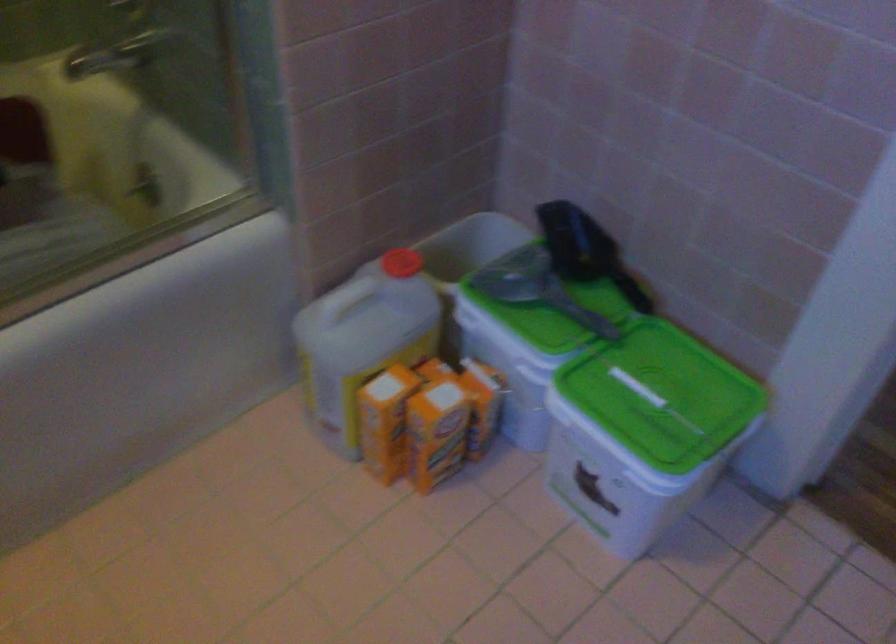
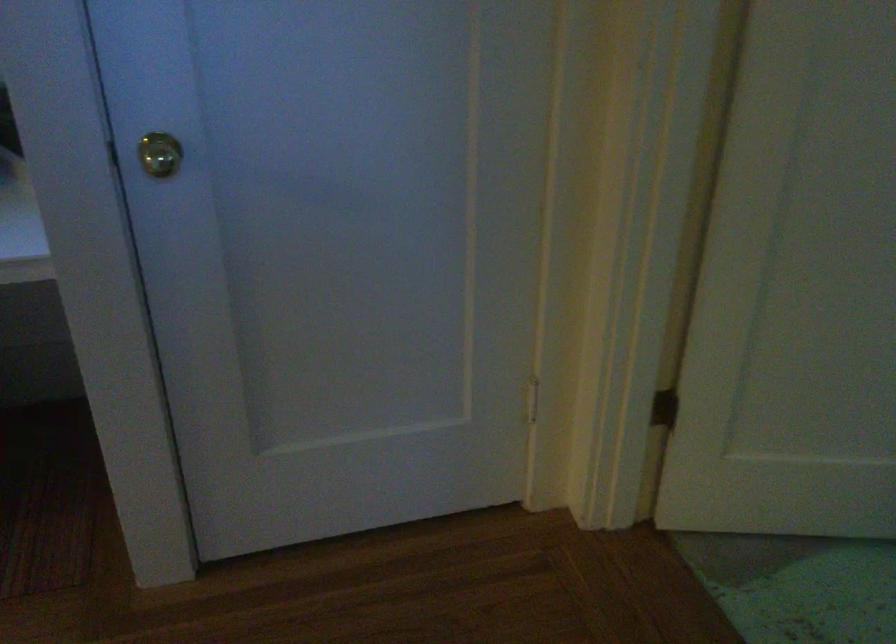
Question: The camera is either moving clockwise (left) or counter-clockwise (right) around the object. The first image is from the beginning of the video and the second image is from the end. Is the camera moving left or right when shooting the video?

Choices:
 (A) Left
 (B) Right

Answer: (A)